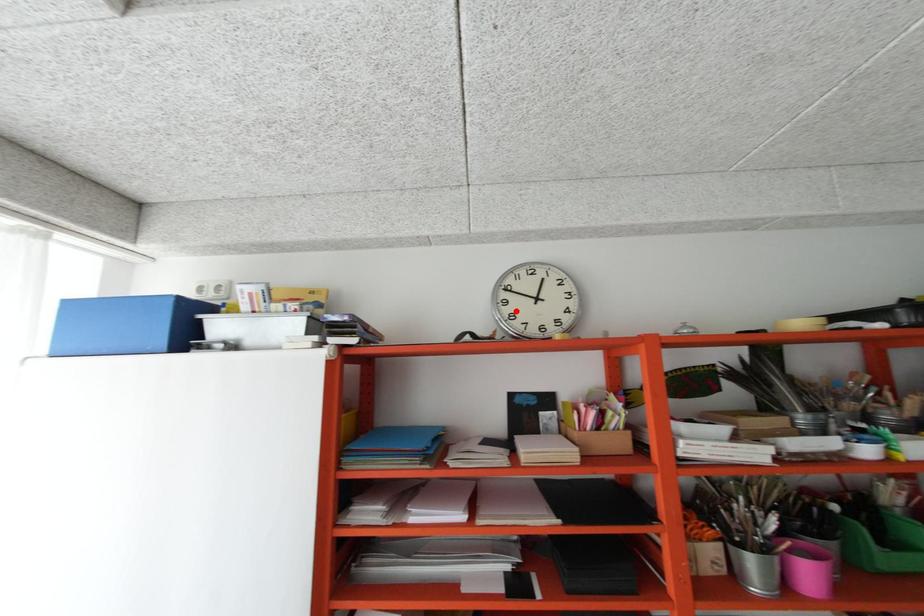
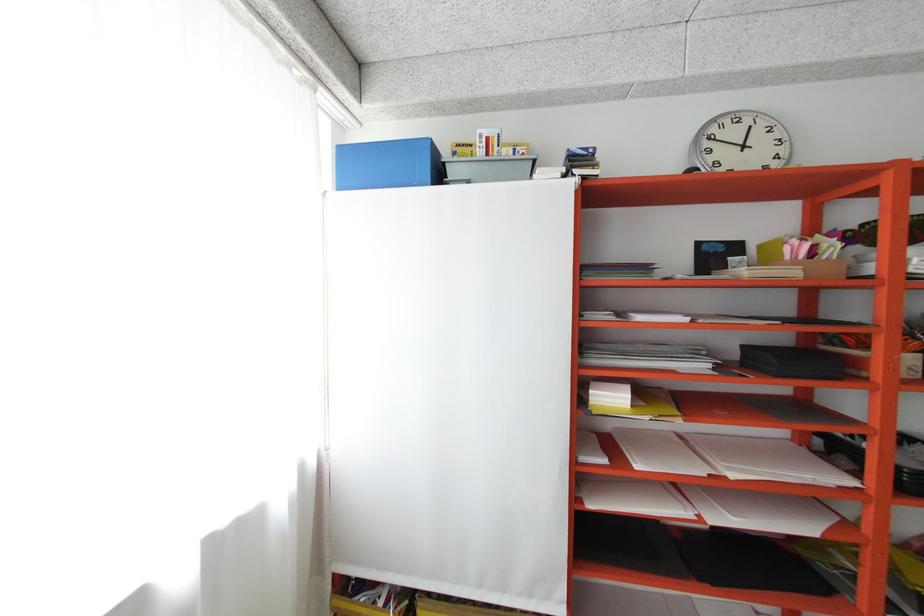
Question: I am providing you with two images of the same scene from different viewpoints. A red point is marked on the first image. At the location where the point appears in image 1, is it still visible in image 2?

Choices:
 (A) Yes
 (B) No

Answer: (A)